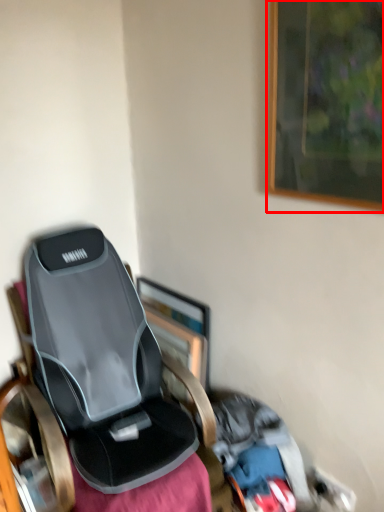
Question: From the image's perspective, where is picture frame (annotated by the red box) located relative to picture frame?

Choices:
 (A) below
 (B) above

Answer: (B)